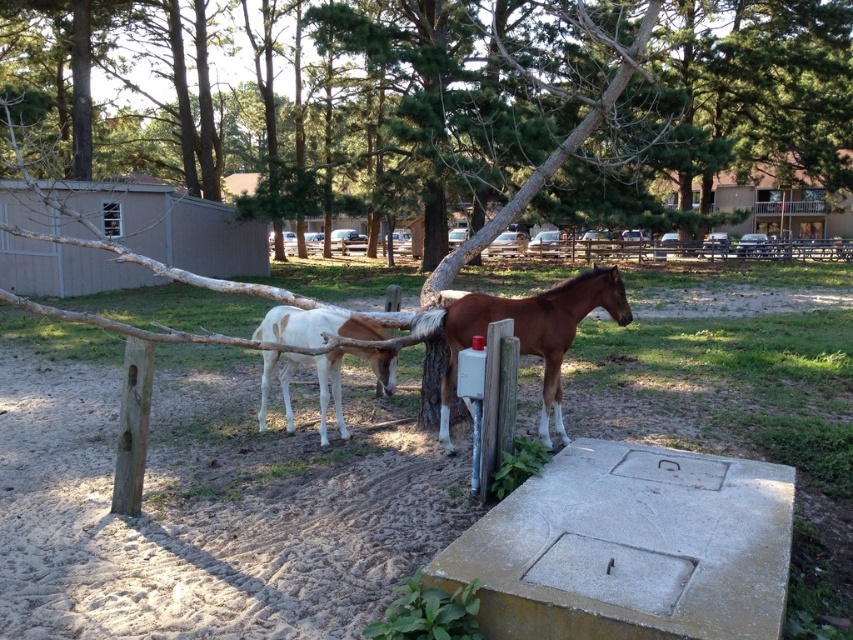
Who is more distant from viewer, [335,416] or [350,248]?

Positioned behind is point [350,248].

At what (x,y) coordinates should I click in order to perform the action: click on white glossy horse at center. Please return your answer as a coordinate pair (x, y). The image size is (853, 640). Looking at the image, I should click on (335, 380).

Does brown glossy horse at center come in front of white glossy horse at center?

That is True.

Does brown glossy horse at center have a larger size compared to white glossy horse at center?

Indeed, brown glossy horse at center has a larger size compared to white glossy horse at center.

Where is `brown glossy horse at center`? The height and width of the screenshot is (640, 853). brown glossy horse at center is located at coordinates (531, 333).

Find the location of `green leafy tree at center`. green leafy tree at center is located at coordinates (570, 99).

Image resolution: width=853 pixels, height=640 pixels. What are the coordinates of `green leafy tree at center` in the screenshot? It's located at (570, 99).